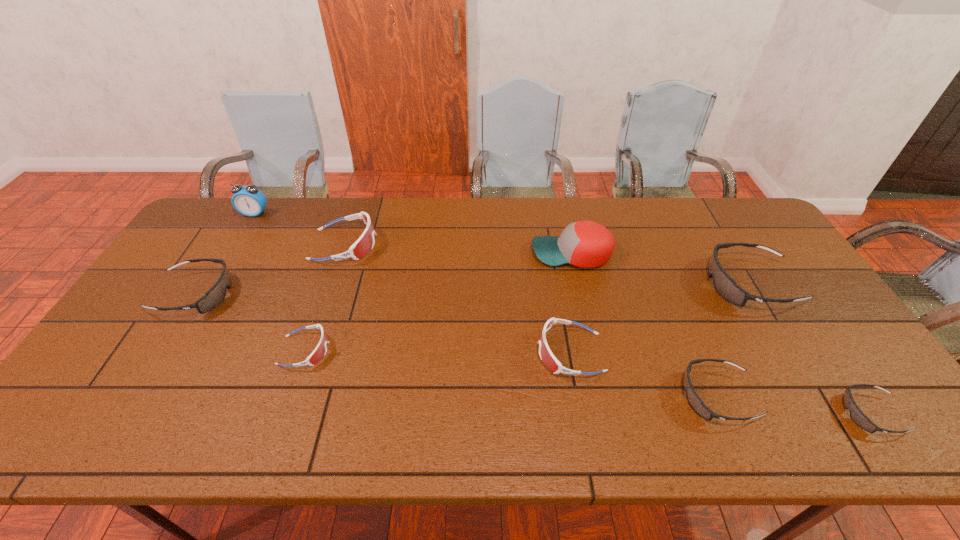
Where is `empty space between the red baseball cap and the farthest red goggles`? This screenshot has height=540, width=960. empty space between the red baseball cap and the farthest red goggles is located at coordinates (458, 249).

Where is `free space between the seventh object from left to right and the biggest black goggles`? The height and width of the screenshot is (540, 960). free space between the seventh object from left to right and the biggest black goggles is located at coordinates (733, 340).

Where is `vacant point located between the leftmost goggles and the smallest red goggles`? vacant point located between the leftmost goggles and the smallest red goggles is located at coordinates (251, 322).

You are a GUI agent. You are given a task and a screenshot of the screen. Output one action in this format:
    pyautogui.click(x=<x>, y=<y>)
    Task: Click on the free space that is in between the farthest red goggles and the smallest red goggles
    This screenshot has width=960, height=540.
    Given the screenshot: What is the action you would take?
    pyautogui.click(x=324, y=298)

Select which object is the closest to the shortest object. Please provide its 2D coordinates. Your answer should be formatted as a tuple, i.e. [(x, y)], where the tuple contains the x and y coordinates of a point satisfying the conditions above.

[(694, 400)]

Find the location of a particular element. This screenshot has width=960, height=540. object that stands as the sixth closest to the leftmost black goggles is located at coordinates (694, 400).

Identify the location of goggles that is the second closest to the biggest red goggles. This screenshot has width=960, height=540. (320, 351).

Identify which goggles is located as the nearest to the second biggest black goggles. Please provide its 2D coordinates. Your answer should be formatted as a tuple, i.e. [(x, y)], where the tuple contains the x and y coordinates of a point satisfying the conditions above.

[(365, 243)]

Select which red goggles is the second closest to the smallest black goggles. Please provide its 2D coordinates. Your answer should be formatted as a tuple, i.e. [(x, y)], where the tuple contains the x and y coordinates of a point satisfying the conditions above.

[(320, 351)]

Choose which red goggles is the nearest neighbor to the shortest goggles. Please provide its 2D coordinates. Your answer should be formatted as a tuple, i.e. [(x, y)], where the tuple contains the x and y coordinates of a point satisfying the conditions above.

[(547, 357)]